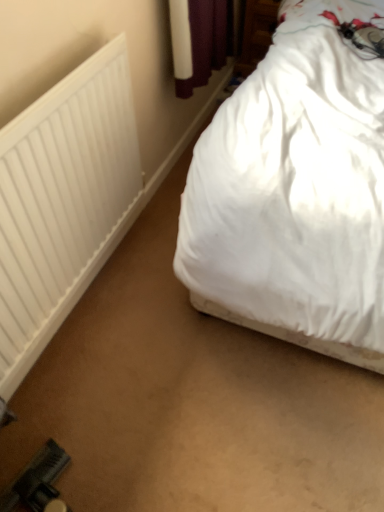
Find the location of a particular element. white soft bed at upper right is located at coordinates point(297,189).

Describe the element at coordinates (297, 189) in the screenshot. I see `white soft bed at upper right` at that location.

Image resolution: width=384 pixels, height=512 pixels. What do you see at coordinates (63, 201) in the screenshot? I see `white matte radiator at left` at bounding box center [63, 201].

Where is `white matte radiator at left`? The image size is (384, 512). white matte radiator at left is located at coordinates (x=63, y=201).

At what (x,y) coordinates should I click in order to perform the action: click on white soft bed at upper right. Please return your answer as a coordinate pair (x, y). The height and width of the screenshot is (512, 384). Looking at the image, I should click on (297, 189).

Can you confirm if white matte radiator at left is positioned to the right of white soft bed at upper right?

Incorrect, white matte radiator at left is not on the right side of white soft bed at upper right.

Based on the photo, which object is closer to the camera, white matte radiator at left or white soft bed at upper right?

white soft bed at upper right is more forward.

Which is closer, (x=4, y=206) or (x=308, y=213)?

Positioned in front is point (x=4, y=206).

From the image's perspective, would you say white matte radiator at left is positioned over white soft bed at upper right?

No, from the image's perspective, white matte radiator at left is not on top of white soft bed at upper right.

From a real-world perspective, is white matte radiator at left physically below white soft bed at upper right?

Correct, in the physical world, white matte radiator at left is lower than white soft bed at upper right.

Is white matte radiator at left wider or thinner than white soft bed at upper right?

white matte radiator at left is thinner than white soft bed at upper right.

Considering the sizes of objects white matte radiator at left and white soft bed at upper right in the image provided, who is taller, white matte radiator at left or white soft bed at upper right?

white soft bed at upper right is taller.

Which of these two, white matte radiator at left or white soft bed at upper right, is bigger?

white soft bed at upper right.

Is white matte radiator at left outside of white soft bed at upper right?

Yes, white matte radiator at left is located beyond the bounds of white soft bed at upper right.

Are white matte radiator at left and white soft bed at upper right far apart?

No, white matte radiator at left is in close proximity to white soft bed at upper right.

Is white matte radiator at left aimed at white soft bed at upper right?

Yes, white matte radiator at left is aimed at white soft bed at upper right.

What's the angular difference between white matte radiator at left and white soft bed at upper right's facing directions?

89.1 degrees.

Where is `radiator that is under the white soft bed at upper right (from a real-world perspective)`? radiator that is under the white soft bed at upper right (from a real-world perspective) is located at coordinates (63, 201).

Can you confirm if white soft bed at upper right is positioned to the left of white matte radiator at left?

No.

Is white soft bed at upper right in front of or behind white matte radiator at left in the image?

white soft bed at upper right is in front of white matte radiator at left.

Is point (275, 64) in front of point (15, 339)?

No, it is not.

From the image's perspective, is white soft bed at upper right on white matte radiator at left?

Yes, from the image's perspective, white soft bed at upper right is on top of white matte radiator at left.

From a real-world perspective, which is physically above, white soft bed at upper right or white matte radiator at left?

white soft bed at upper right, from a real-world perspective.

Considering the relative sizes of white soft bed at upper right and white matte radiator at left in the image provided, is white soft bed at upper right wider than white matte radiator at left?

Yes, white soft bed at upper right is wider than white matte radiator at left.

Considering the sizes of objects white soft bed at upper right and white matte radiator at left in the image provided, who is shorter, white soft bed at upper right or white matte radiator at left?

white matte radiator at left is shorter.

Considering the relative sizes of white soft bed at upper right and white matte radiator at left in the image provided, is white soft bed at upper right smaller than white matte radiator at left?

Actually, white soft bed at upper right might be larger than white matte radiator at left.

Is white soft bed at upper right outside of white matte radiator at left?

Yes.

Are white soft bed at upper right and white matte radiator at left far apart?

white soft bed at upper right is actually quite close to white matte radiator at left.

Is white soft bed at upper right oriented away from white matte radiator at left?

white soft bed at upper right does not have its back to white matte radiator at left.

Can you tell me how much white soft bed at upper right and white matte radiator at left differ in facing direction?

The facing directions of white soft bed at upper right and white matte radiator at left are 89.1 degrees apart.

The height and width of the screenshot is (512, 384). I want to click on bed on the right of white matte radiator at left, so click(x=297, y=189).

Image resolution: width=384 pixels, height=512 pixels. What are the coordinates of `radiator below the white soft bed at upper right (from a real-world perspective)` in the screenshot? It's located at [63, 201].

Where is `bed on the right of white matte radiator at left`? Image resolution: width=384 pixels, height=512 pixels. bed on the right of white matte radiator at left is located at coordinates (297, 189).